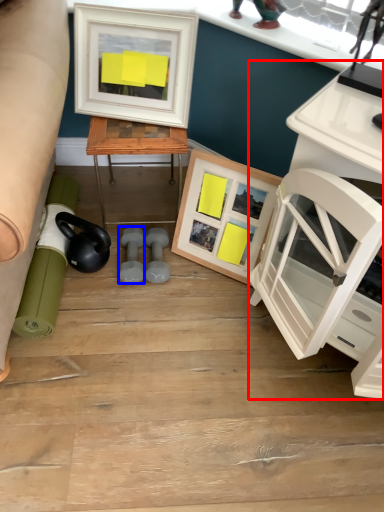
Question: Which object appears closest to the camera in this image, computer desk (highlighted by a red box) or dumbbell (highlighted by a blue box)?

Choices:
 (A) computer desk
 (B) dumbbell

Answer: (A)